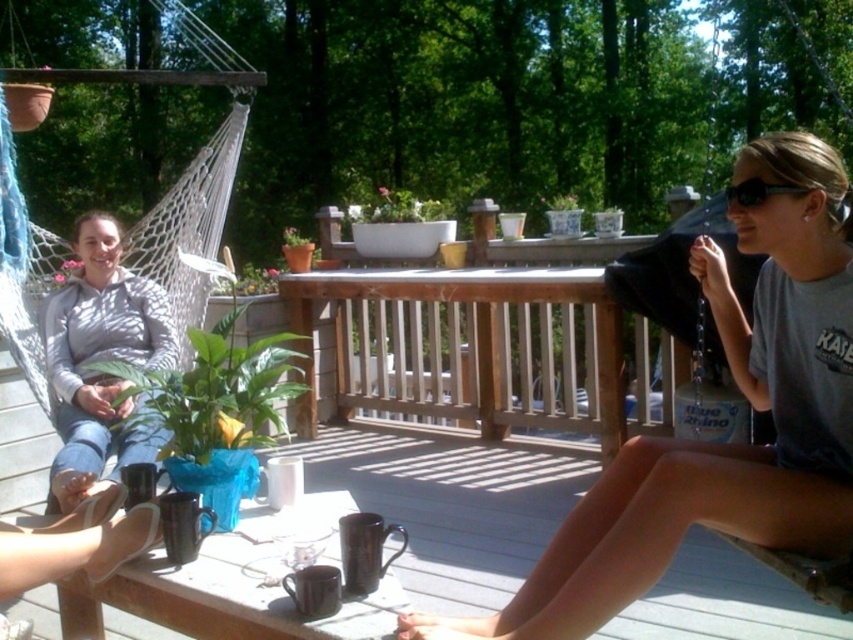
Question: Is matte black bag at right to the left of black plastic sunglasses at upper right from the viewer's perspective?

Choices:
 (A) yes
 (B) no

Answer: (A)

Question: Which of the following is the closest to the observer?

Choices:
 (A) (701, 394)
 (B) (146, 456)
 (C) (776, 336)
 (D) (757, 196)

Answer: (D)

Question: Which object is farther from the camera taking this photo?

Choices:
 (A) black plastic sunglasses at upper right
 (B) matte black bag at right
 (C) light gray hoodie at left

Answer: (C)

Question: Is light gray hoodie at left smaller than black fabric swing at upper right?

Choices:
 (A) yes
 (B) no

Answer: (A)

Question: Is the position of matte black bag at right less distant than that of black fabric swing at upper right?

Choices:
 (A) no
 (B) yes

Answer: (B)

Question: Based on their relative distances, which object is nearer to the black plastic sunglasses at upper right?

Choices:
 (A) matte black bag at right
 (B) light gray hoodie at left
 (C) black fabric swing at upper right

Answer: (A)